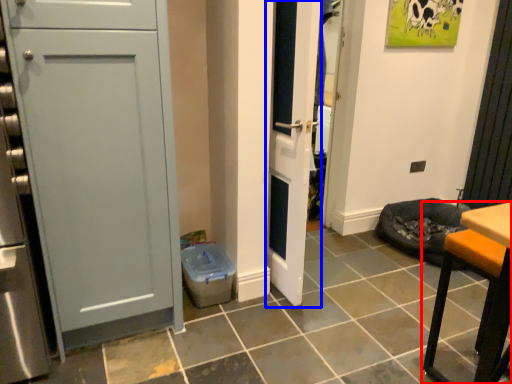
Question: Which of the following is the farthest to the observer, furniture (highlighted by a red box) or door (highlighted by a blue box)?

Choices:
 (A) furniture
 (B) door

Answer: (B)